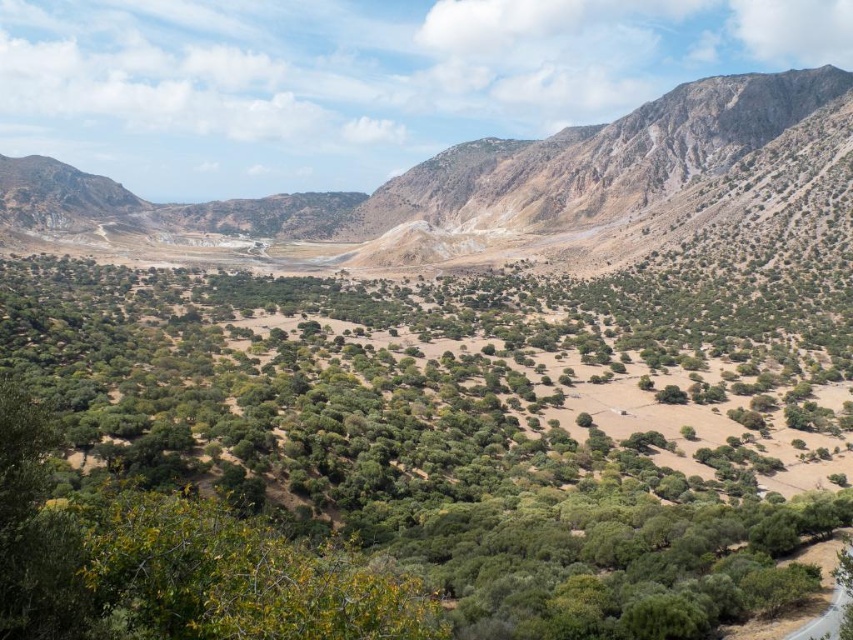
You are an environmental scientist assessing the landscape. You notice the green leafy trees at center and the dull brown rocky mountain at upper right. Which of these two features takes up more area in the scene?

The dull brown rocky mountain at upper right occupies more space than the green leafy trees at center according to the description.

You are a hiker planning to cross the landscape from the dense shrubs to the mountain. Which direction should you head to reach the dull brown rocky mountain at upper right while avoiding the green leafy trees at center?

You should head towards the upper right direction to reach the dull brown rocky mountain at upper right while avoiding the green leafy trees at center, since the green leafy trees at center are positioned under the mountain and might block the path.

You are standing in the middle of the landscape and want to walk towards the green leafy trees at center and the dull brown rocky mountain at upper right. Which object will you reach first?

You will reach the green leafy trees at center first because they are closer to you than the dull brown rocky mountain at upper right.